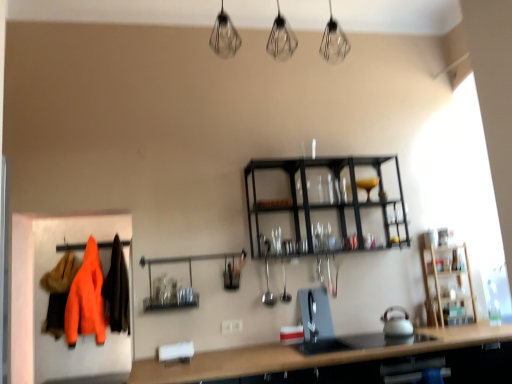
Question: Is orange fabric coat at left inside the boundaries of metallic glassware at center, or outside?

Choices:
 (A) outside
 (B) inside

Answer: (A)

Question: Would you say orange fabric coat at left is to the left or to the right of metallic glassware at center in the picture?

Choices:
 (A) right
 (B) left

Answer: (B)

Question: In terms of width, does orange fabric coat at left look wider or thinner when compared to metallic glassware at center?

Choices:
 (A) thin
 (B) wide

Answer: (A)

Question: Considering the positions of metallic glassware at center and orange fabric coat at left in the image, is metallic glassware at center bigger or smaller than orange fabric coat at left?

Choices:
 (A) small
 (B) big

Answer: (A)

Question: Considering the relative positions of metallic glassware at center and orange fabric coat at left in the image provided, is metallic glassware at center to the left or to the right of orange fabric coat at left?

Choices:
 (A) right
 (B) left

Answer: (A)

Question: Is metallic glassware at center wider or thinner than orange fabric coat at left?

Choices:
 (A) wide
 (B) thin

Answer: (A)

Question: Is metallic glassware at center situated inside orange fabric coat at left or outside?

Choices:
 (A) outside
 (B) inside

Answer: (A)